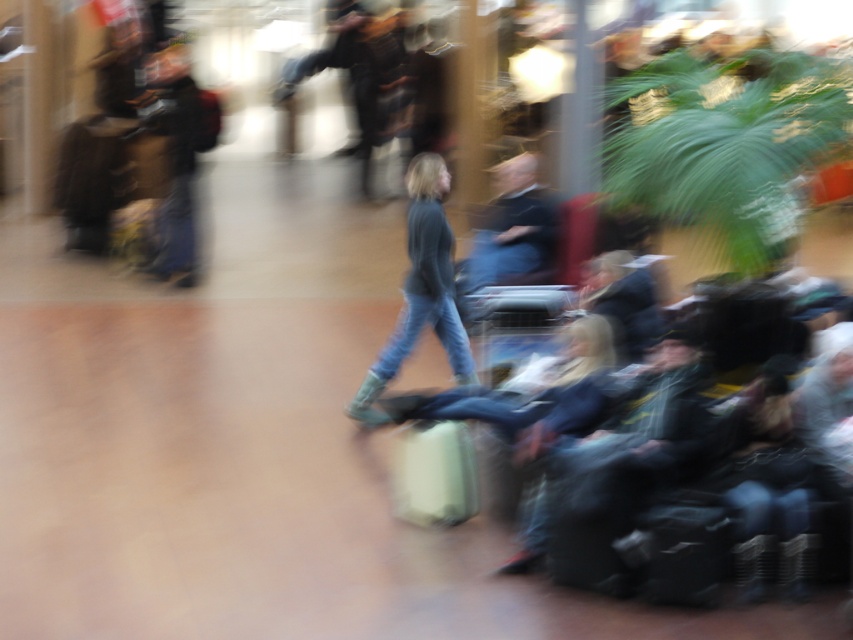
You are standing in the middle of the scene and notice two people wearing denim jeans at center and dark blue sweater at center. Which one is positioned to the left?

The denim jeans at center is to the left of dark blue sweater at center.

You are standing at the point marked by the coordinates point [421,291] in the image. What object is directly beneath your feet?

The point [421,291] is on denim jeans at center, so the object directly beneath your feet is the denim jeans at center.